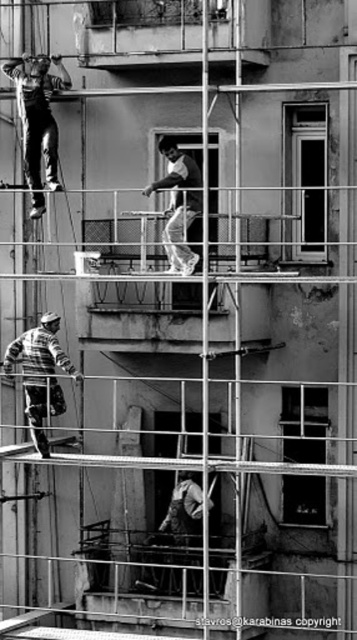
Question: Which object appears farthest from the camera in this image?

Choices:
 (A) striped sweater at lower left
 (B) shiny black overalls at upper left
 (C) smooth white shirt at center

Answer: (B)

Question: Which of the following is the farthest from the observer?

Choices:
 (A) shiny black overalls at upper left
 (B) striped sweater at lower left
 (C) smooth white shirt at center

Answer: (A)

Question: Which of the following is the farthest from the observer?

Choices:
 (A) (57, 412)
 (B) (182, 250)

Answer: (A)

Question: Does shiny black overalls at upper left have a larger size compared to striped sweater at lower left?

Choices:
 (A) no
 (B) yes

Answer: (B)

Question: Is shiny black overalls at upper left thinner than smooth white shirt at center?

Choices:
 (A) no
 (B) yes

Answer: (A)

Question: Is shiny black overalls at upper left smaller than smooth white shirt at center?

Choices:
 (A) no
 (B) yes

Answer: (A)